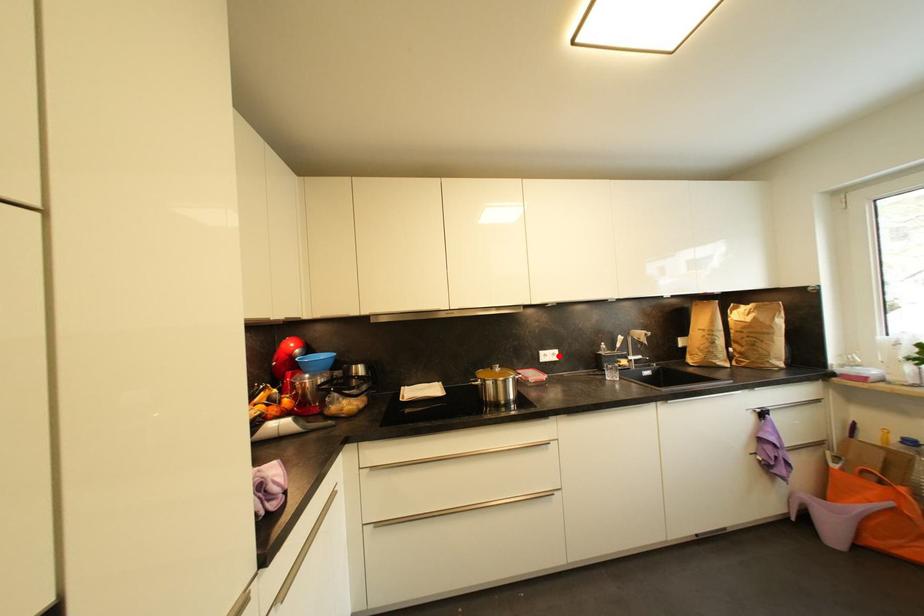
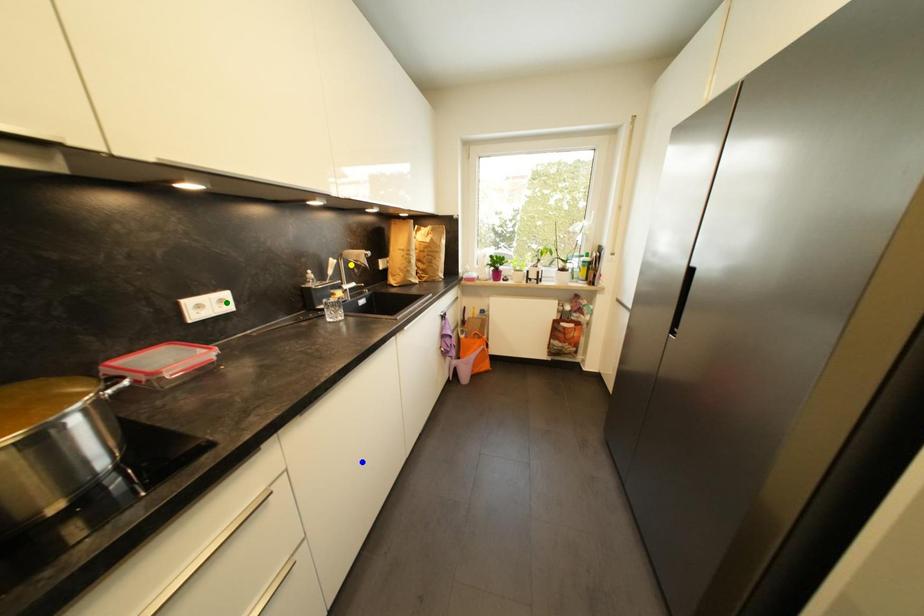
Question: I am providing you with two images of the same scene from different viewpoints. A red point is marked on the first image. You are given multiple points on the second image. Which point in image 2 is actually the same real-world point as the red point in image 1?

Choices:
 (A) green point
 (B) yellow point
 (C) blue point

Answer: (A)